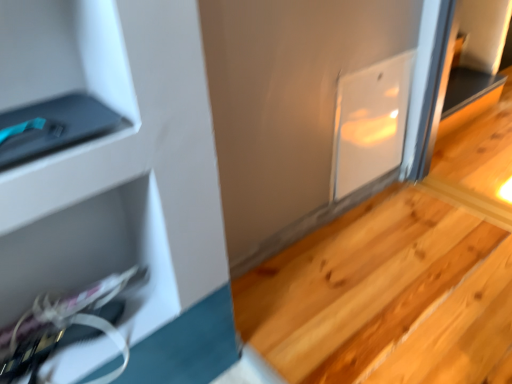
Question: Is point (131, 355) closer or farther from the camera than point (413, 279)?

Choices:
 (A) closer
 (B) farther

Answer: (A)

Question: From the image's perspective, relative to natural wood stairs at lower right, is white glossy scissors at lower left above or below?

Choices:
 (A) above
 (B) below

Answer: (A)

Question: Based on their sizes in the image, would you say white glossy scissors at lower left is bigger or smaller than natural wood stairs at lower right?

Choices:
 (A) small
 (B) big

Answer: (A)

Question: Which is correct: natural wood stairs at lower right is inside white glossy scissors at lower left, or outside of it?

Choices:
 (A) outside
 (B) inside

Answer: (A)

Question: In the image, is natural wood stairs at lower right positioned in front of or behind white glossy scissors at lower left?

Choices:
 (A) front
 (B) behind

Answer: (B)

Question: In terms of width, does natural wood stairs at lower right look wider or thinner when compared to white glossy scissors at lower left?

Choices:
 (A) wide
 (B) thin

Answer: (A)

Question: Looking at the image, does natural wood stairs at lower right seem bigger or smaller compared to white glossy scissors at lower left?

Choices:
 (A) small
 (B) big

Answer: (B)